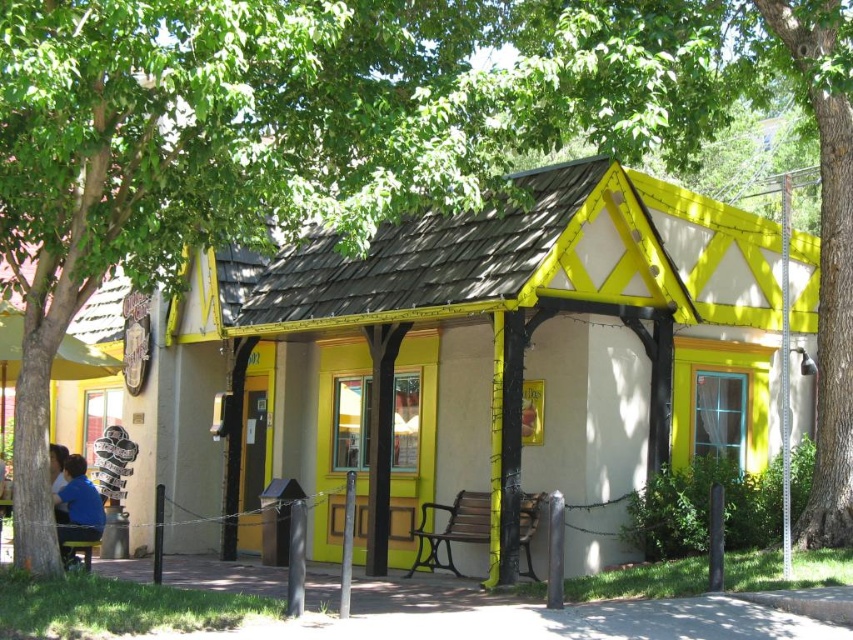
Question: Is yellow wood cabin at center further to camera compared to blue shirt at lower left?

Choices:
 (A) yes
 (B) no

Answer: (A)

Question: Which point appears farthest from the camera in this image?

Choices:
 (A) 68,524
 (B) 496,225

Answer: (B)

Question: Considering the relative positions of yellow wood cabin at center and blue shirt at lower left in the image provided, where is yellow wood cabin at center located with respect to blue shirt at lower left?

Choices:
 (A) below
 (B) above

Answer: (B)

Question: Can you confirm if yellow wood cabin at center is thinner than blue shirt at lower left?

Choices:
 (A) yes
 (B) no

Answer: (A)

Question: Which point is closer to the camera taking this photo?

Choices:
 (A) (741, 388)
 (B) (62, 552)

Answer: (B)

Question: Among these objects, which one is nearest to the camera?

Choices:
 (A) blue shirt at lower left
 (B) yellow wood cabin at center

Answer: (A)